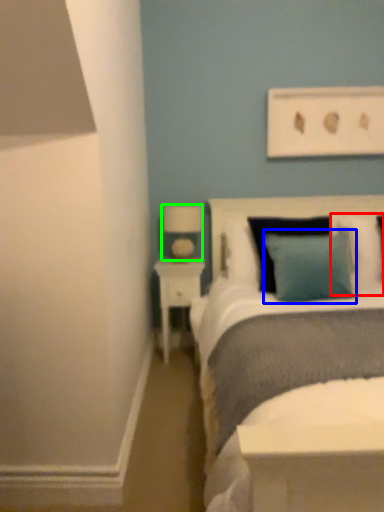
Question: Which object is the closest to the pillow (highlighted by a red box)? Choose among these: pillow (highlighted by a blue box) or lamp (highlighted by a green box).

Choices:
 (A) pillow
 (B) lamp

Answer: (A)